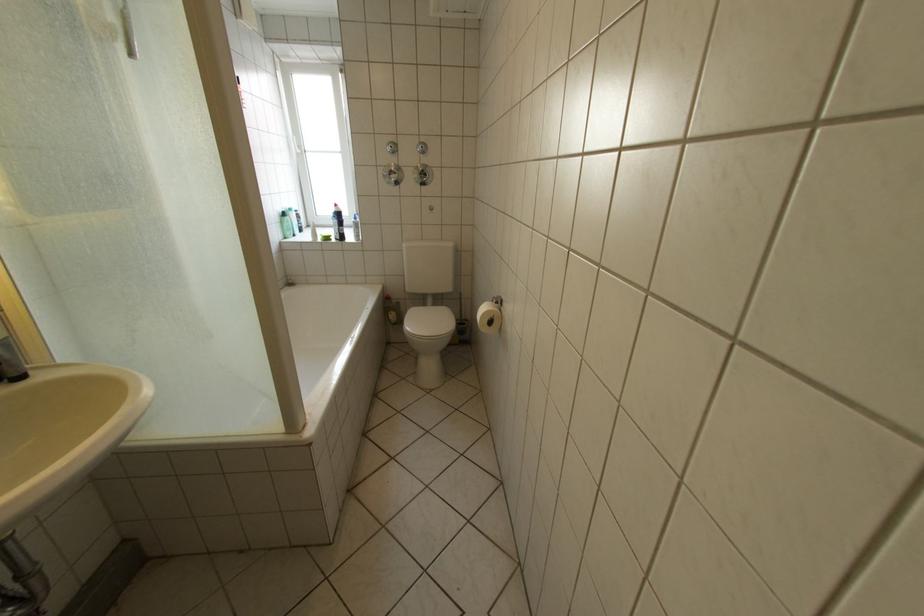
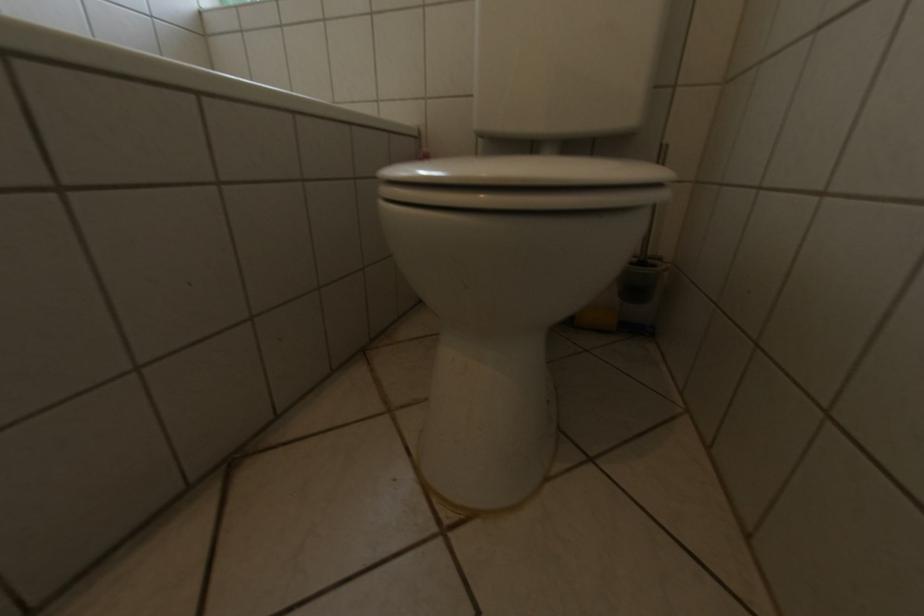
Question: In a continuous first-person perspective shot, in which direction is the camera moving?

Choices:
 (A) Left
 (B) Right
 (C) Forward
 (D) Backward

Answer: (C)